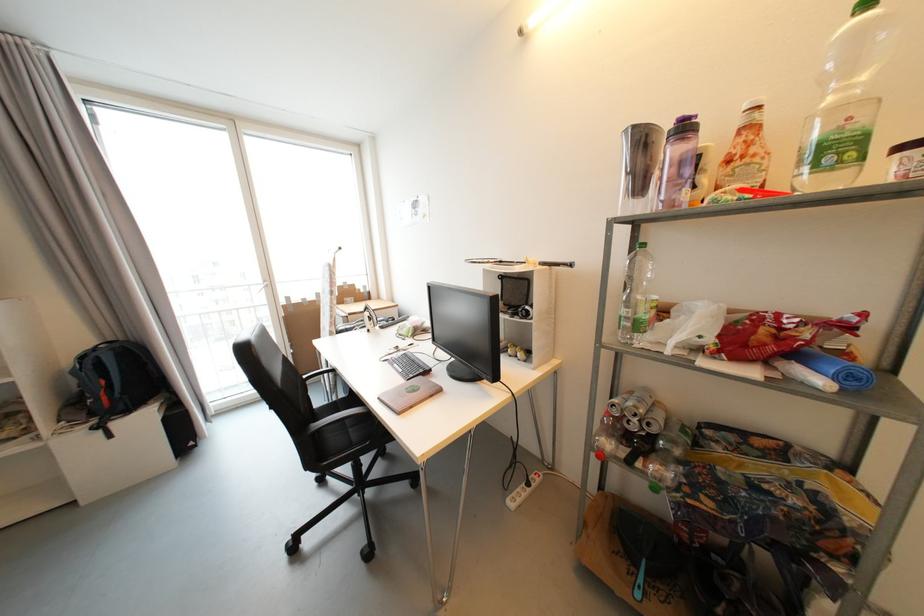
I want to click on black chair armrest, so click(325, 379).